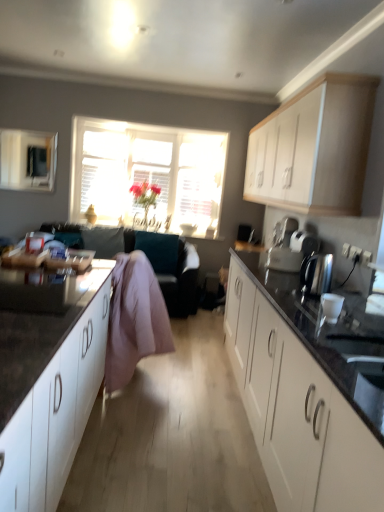
Question: Is pink fabric at center facing towards pink fabric couch at center?

Choices:
 (A) yes
 (B) no

Answer: (B)

Question: Does pink fabric at center have a greater height compared to pink fabric couch at center?

Choices:
 (A) no
 (B) yes

Answer: (B)

Question: From the image's perspective, does pink fabric at center appear lower than pink fabric couch at center?

Choices:
 (A) no
 (B) yes

Answer: (B)

Question: Is pink fabric at center positioned far away from pink fabric couch at center?

Choices:
 (A) yes
 (B) no

Answer: (A)

Question: Is pink fabric couch at center a part of pink fabric at center?

Choices:
 (A) no
 (B) yes

Answer: (A)

Question: Is pink fabric at center to the right of pink fabric couch at center from the viewer's perspective?

Choices:
 (A) yes
 (B) no

Answer: (A)

Question: Does translucent glass window at center have a lesser height compared to pink fabric couch at center?

Choices:
 (A) yes
 (B) no

Answer: (B)

Question: Is translucent glass window at center next to pink fabric couch at center?

Choices:
 (A) no
 (B) yes

Answer: (A)

Question: From a real-world perspective, is translucent glass window at center below pink fabric couch at center?

Choices:
 (A) yes
 (B) no

Answer: (B)

Question: Considering the relative sizes of translucent glass window at center and pink fabric couch at center in the image provided, is translucent glass window at center smaller than pink fabric couch at center?

Choices:
 (A) yes
 (B) no

Answer: (A)

Question: From a real-world perspective, is translucent glass window at center on pink fabric couch at center?

Choices:
 (A) no
 (B) yes

Answer: (B)

Question: Is translucent glass window at center located outside pink fabric couch at center?

Choices:
 (A) yes
 (B) no

Answer: (A)

Question: Can you confirm if white matte cabinet at lower left, which ranks as the 1th cabinetry in left-to-right order, is positioned to the right of satin silver toaster at upper right?

Choices:
 (A) no
 (B) yes

Answer: (A)